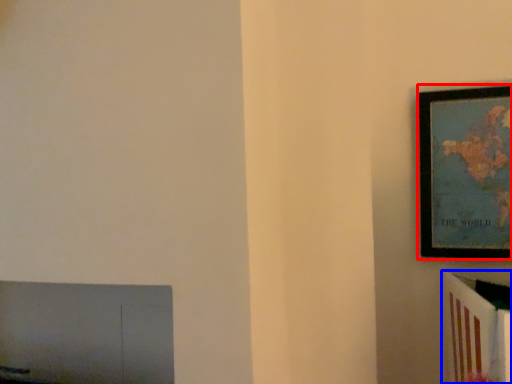
Question: Which object is closer to the camera taking this photo, picture frame (highlighted by a red box) or furniture (highlighted by a blue box)?

Choices:
 (A) picture frame
 (B) furniture

Answer: (B)